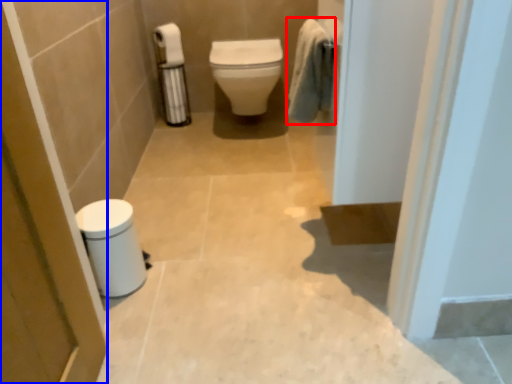
Question: Among these objects, which one is farthest to the camera, bath towel (highlighted by a red box) or screen door (highlighted by a blue box)?

Choices:
 (A) bath towel
 (B) screen door

Answer: (A)